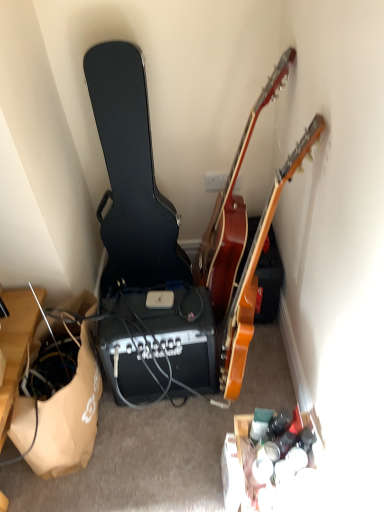
The image size is (384, 512). Describe the element at coordinates (69, 417) in the screenshot. I see `brown paper bag at lower left` at that location.

Locate an element on the screen. Image resolution: width=384 pixels, height=512 pixels. black plastic speaker at center is located at coordinates (158, 343).

How many degrees apart are the facing directions of glossy wood guitar at upper right, which is counted as the 2th guitar, starting from the left, and wooden acoustic guitar at upper right, the third guitar viewed from the left?

They differ by 0.000213 degrees in their facing directions.

Is glossy wood guitar at upper right, acting as the second guitar starting from the right, in contact with wooden acoustic guitar at upper right, the third guitar viewed from the left?

No, glossy wood guitar at upper right, acting as the second guitar starting from the right, is not making contact with wooden acoustic guitar at upper right, the third guitar viewed from the left.

From the image's perspective, between glossy wood guitar at upper right, which is counted as the 2th guitar, starting from the left, and wooden acoustic guitar at upper right, which ranks as the 1th guitar in right-to-left order, which one is located above?

glossy wood guitar at upper right, which is counted as the 2th guitar, starting from the left, from the image's perspective.

Between glossy wood guitar at upper right, which is counted as the 2th guitar, starting from the left, and wooden acoustic guitar at upper right, which ranks as the 1th guitar in right-to-left order, which one has more height?

Standing taller between the two is wooden acoustic guitar at upper right, which ranks as the 1th guitar in right-to-left order.

From the image's perspective, would you say glossy wood guitar at upper right, acting as the second guitar starting from the right, is shown under brown paper bag at lower left?

No, from the image's perspective, glossy wood guitar at upper right, acting as the second guitar starting from the right, is not beneath brown paper bag at lower left.

Based on the photo, considering the positions of objects glossy wood guitar at upper right, acting as the second guitar starting from the right, and brown paper bag at lower left in the image provided, who is more to the left, glossy wood guitar at upper right, acting as the second guitar starting from the right, or brown paper bag at lower left?

brown paper bag at lower left is more to the left.

Considering the relative sizes of glossy wood guitar at upper right, acting as the second guitar starting from the right, and brown paper bag at lower left in the image provided, is glossy wood guitar at upper right, acting as the second guitar starting from the right, bigger than brown paper bag at lower left?

Correct, glossy wood guitar at upper right, acting as the second guitar starting from the right, is larger in size than brown paper bag at lower left.

Between glossy wood guitar at upper right, which is counted as the 2th guitar, starting from the left, and brown paper bag at lower left, which one has less height?

With less height is brown paper bag at lower left.

Can you confirm if glossy wood guitar at upper right, acting as the second guitar starting from the right, is shorter than black hard case at left, the 3th guitar viewed from the right?

Yes, glossy wood guitar at upper right, acting as the second guitar starting from the right, is shorter than black hard case at left, the 3th guitar viewed from the right.

Could you measure the distance between glossy wood guitar at upper right, which is counted as the 2th guitar, starting from the left, and black hard case at left, the 3th guitar viewed from the right?

glossy wood guitar at upper right, which is counted as the 2th guitar, starting from the left, and black hard case at left, the 3th guitar viewed from the right, are 12.42 inches apart.

Can black hard case at left, the 3th guitar viewed from the right, be found inside glossy wood guitar at upper right, which is counted as the 2th guitar, starting from the left?

No, black hard case at left, the 3th guitar viewed from the right, is not surrounded by glossy wood guitar at upper right, which is counted as the 2th guitar, starting from the left.

From the image's perspective, is glossy wood guitar at upper right, acting as the second guitar starting from the right, above or below black hard case at left, which is the first guitar in left-to-right order?

Based on their image positions, glossy wood guitar at upper right, acting as the second guitar starting from the right, is located above black hard case at left, which is the first guitar in left-to-right order.

Considering the points (137, 79) and (82, 434), which point is in front, point (137, 79) or point (82, 434)?

Point (137, 79)

You are a GUI agent. You are given a task and a screenshot of the screen. Output one action in this format:
    pyautogui.click(x=<x>, y=<y>)
    Task: Click on the guitar located behind the brown paper bag at lower left
    Image resolution: width=384 pixels, height=512 pixels.
    Given the screenshot: What is the action you would take?
    pyautogui.click(x=131, y=175)

Does black hard case at left, which is the first guitar in left-to-right order, turn towards brown paper bag at lower left?

Yes, black hard case at left, which is the first guitar in left-to-right order, faces towards brown paper bag at lower left.

From a real-world perspective, count 3rd guitars upward from the brown paper bag at lower left and point to it. Please provide its 2D coordinates.

[(233, 210)]

Which of these two, brown paper bag at lower left or glossy wood guitar at upper right, acting as the second guitar starting from the right, stands shorter?

brown paper bag at lower left is shorter.

Is brown paper bag at lower left oriented towards glossy wood guitar at upper right, which is counted as the 2th guitar, starting from the left?

No, brown paper bag at lower left does not turn towards glossy wood guitar at upper right, which is counted as the 2th guitar, starting from the left.

From the image's perspective, is black hard case at left, which is the first guitar in left-to-right order, located above or below glossy wood guitar at upper right, which is counted as the 2th guitar, starting from the left?

From the image's perspective, black hard case at left, which is the first guitar in left-to-right order, appears below glossy wood guitar at upper right, which is counted as the 2th guitar, starting from the left.

Is glossy wood guitar at upper right, which is counted as the 2th guitar, starting from the left, surrounded by black hard case at left, the 3th guitar viewed from the right?

No, glossy wood guitar at upper right, which is counted as the 2th guitar, starting from the left, is not a part of black hard case at left, the 3th guitar viewed from the right.

Measure the distance from black hard case at left, the 3th guitar viewed from the right, to glossy wood guitar at upper right, which is counted as the 2th guitar, starting from the left.

12.42 inches.

In order to click on paper bag below the wooden acoustic guitar at upper right, the third guitar viewed from the left (from the image's perspective) in this screenshot , I will do `click(69, 417)`.

From the image's perspective, which object appears higher, wooden acoustic guitar at upper right, which ranks as the 1th guitar in right-to-left order, or brown paper bag at lower left?

wooden acoustic guitar at upper right, which ranks as the 1th guitar in right-to-left order, is shown above in the image.

Is point (225, 398) more distant than point (92, 419)?

No, it is not.

Is wooden acoustic guitar at upper right, the third guitar viewed from the left, aimed at brown paper bag at lower left?

Yes, wooden acoustic guitar at upper right, the third guitar viewed from the left, faces towards brown paper bag at lower left.

From a real-world perspective, which guitar is the 2nd one above the wooden acoustic guitar at upper right, the third guitar viewed from the left? Please provide its 2D coordinates.

[(233, 210)]

Image resolution: width=384 pixels, height=512 pixels. I want to click on paper bag below the glossy wood guitar at upper right, acting as the second guitar starting from the right (from the image's perspective), so click(x=69, y=417).

From the image, which object appears to be nearer to brown paper bag at lower left, black plastic speaker at center or black hard case at left, which is the first guitar in left-to-right order?

black plastic speaker at center lies closer to brown paper bag at lower left than the other object.

Estimate the real-world distances between objects in this image. Which object is further from black hard case at left, which is the first guitar in left-to-right order, glossy wood guitar at upper right, acting as the second guitar starting from the right, or brown paper bag at lower left?

Based on the image, brown paper bag at lower left appears to be further to black hard case at left, which is the first guitar in left-to-right order.

Which object lies nearer to the anchor point black hard case at left, the 3th guitar viewed from the right, wooden acoustic guitar at upper right, which ranks as the 1th guitar in right-to-left order, or brown paper bag at lower left?

brown paper bag at lower left.

When comparing their distances from brown paper bag at lower left, does glossy wood guitar at upper right, acting as the second guitar starting from the right, or black hard case at left, which is the first guitar in left-to-right order, seem further?

glossy wood guitar at upper right, acting as the second guitar starting from the right, is positioned further to the anchor brown paper bag at lower left.

Consider the image. From the image, which object appears to be farther from black hard case at left, which is the first guitar in left-to-right order, brown paper bag at lower left or glossy wood guitar at upper right, acting as the second guitar starting from the right?

brown paper bag at lower left lies further to black hard case at left, which is the first guitar in left-to-right order, than the other object.

Which object lies further to the anchor point black plastic speaker at center, wooden acoustic guitar at upper right, which ranks as the 1th guitar in right-to-left order, or glossy wood guitar at upper right, which is counted as the 2th guitar, starting from the left?

Among the two, glossy wood guitar at upper right, which is counted as the 2th guitar, starting from the left, is located further to black plastic speaker at center.

Looking at the image, which one is located further to glossy wood guitar at upper right, which is counted as the 2th guitar, starting from the left, brown paper bag at lower left or black plastic speaker at center?

The object further to glossy wood guitar at upper right, which is counted as the 2th guitar, starting from the left, is brown paper bag at lower left.

Estimate the real-world distances between objects in this image. Which object is closer to brown paper bag at lower left, glossy wood guitar at upper right, acting as the second guitar starting from the right, or black plastic speaker at center?

black plastic speaker at center is positioned closer to the anchor brown paper bag at lower left.

You are a GUI agent. You are given a task and a screenshot of the screen. Output one action in this format:
    pyautogui.click(x=<x>, y=<y>)
    Task: Click on the guitar between black hard case at left, the 3th guitar viewed from the right, and black plastic speaker at center in the up-down direction
    The image size is (384, 512).
    Given the screenshot: What is the action you would take?
    pyautogui.click(x=255, y=271)

Locate an element on the screen. speaker between glossy wood guitar at upper right, which is counted as the 2th guitar, starting from the left, and brown paper bag at lower left vertically is located at coordinates (158, 343).

Identify the location of speaker between black hard case at left, which is the first guitar in left-to-right order, and brown paper bag at lower left, in the vertical direction. (158, 343).

In order to click on guitar between black hard case at left, the 3th guitar viewed from the right, and wooden acoustic guitar at upper right, which ranks as the 1th guitar in right-to-left order in this screenshot , I will do `click(233, 210)`.